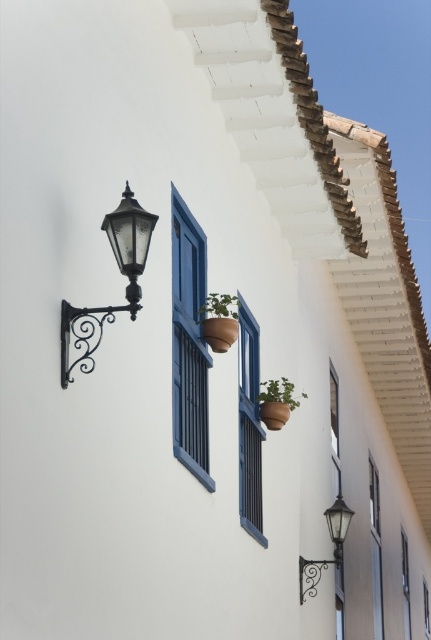
Is clear glass window at right to the right of green matte plant at center from the viewer's perspective?

Yes, clear glass window at right is to the right of green matte plant at center.

Does clear glass window at right have a lesser height compared to green matte plant at center?

No, clear glass window at right is not shorter than green matte plant at center.

Which is in front, point (377, 502) or point (296, 404)?

Point (296, 404) is more forward.

Where is `clear glass window at right`? The height and width of the screenshot is (640, 431). clear glass window at right is located at coordinates (375, 550).

Is blue painted wood shutter at center to the right of matte black lamp at lower right from the viewer's perspective?

No, blue painted wood shutter at center is not to the right of matte black lamp at lower right.

Is point (186, 465) farther from viewer compared to point (334, 563)?

No.

What do you see at coordinates (189, 342) in the screenshot?
I see `blue painted wood shutter at center` at bounding box center [189, 342].

Locate an element on the screen. blue painted wood shutter at center is located at coordinates (189, 342).

Is point (340, 531) more distant than point (381, 637)?

No, (340, 531) is closer to viewer.

Is point (302, 600) in front of point (375, 490)?

Yes, point (302, 600) is in front of point (375, 490).

Between point (336, 536) and point (381, 604), which one is positioned behind?

Point (381, 604)

Where is `matte black lamp at lower right`? matte black lamp at lower right is located at coordinates [x=334, y=547].